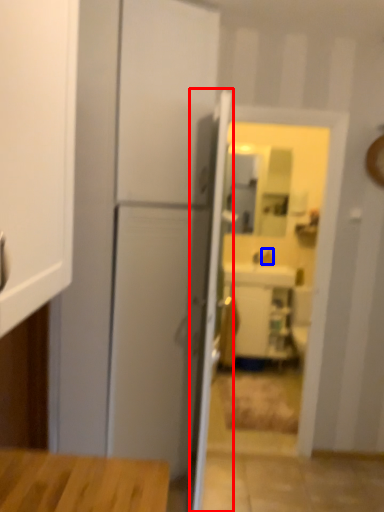
Question: Which object is further to the camera taking this photo, door (highlighted by a red box) or faucet (highlighted by a blue box)?

Choices:
 (A) door
 (B) faucet

Answer: (B)